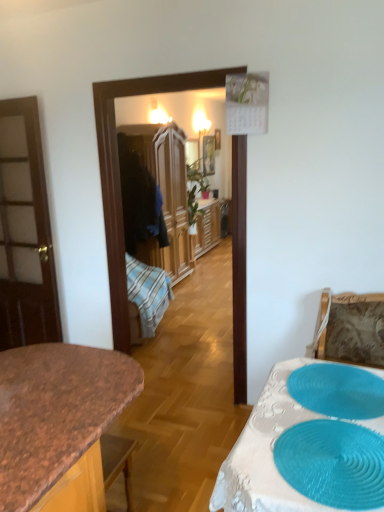
This screenshot has height=512, width=384. Describe the element at coordinates (265, 453) in the screenshot. I see `white lace tablecloth at lower right` at that location.

This screenshot has height=512, width=384. What are the coordinates of `blue textured placemat at lower right, which ranks as the first oval in back-to-front order` in the screenshot? It's located at [x=338, y=391].

Identify the location of granite countertop at center. (59, 423).

What do you see at coordinates (333, 463) in the screenshot?
I see `teal rubber placemat at lower right, arranged as the 2th oval when viewed from the back` at bounding box center [333, 463].

What is the approximate height of teal rubber placemat at lower right, which appears as the 1th oval when viewed from the front?

teal rubber placemat at lower right, which appears as the 1th oval when viewed from the front, is 2.34 centimeters in height.

What do you see at coordinates (208, 155) in the screenshot? This screenshot has height=512, width=384. I see `wooden picture frame at center` at bounding box center [208, 155].

In order to click on white lace tablecloth at lower right in this screenshot , I will do `click(265, 453)`.

Where is `table in front of the teal rubber placemat at lower right, which appears as the 1th oval when viewed from the front`? table in front of the teal rubber placemat at lower right, which appears as the 1th oval when viewed from the front is located at coordinates (265, 453).

Is white lace tablecloth at lower right completely or partially inside teal rubber placemat at lower right, arranged as the 2th oval when viewed from the back?

Definitely not — white lace tablecloth at lower right is not inside teal rubber placemat at lower right, arranged as the 2th oval when viewed from the back.

Does teal rubber placemat at lower right, which appears as the 1th oval when viewed from the front, come in front of white lace tablecloth at lower right?

No, it is behind white lace tablecloth at lower right.

Consider the image. In terms of height, does teal rubber placemat at lower right, which appears as the 1th oval when viewed from the front, look taller or shorter compared to white lace tablecloth at lower right?

teal rubber placemat at lower right, which appears as the 1th oval when viewed from the front, is shorter than white lace tablecloth at lower right.

I want to click on countertop below the wooden wardrobe at center (from a real-world perspective), so click(x=59, y=423).

Is wooden wardrobe at center oriented towards granite countertop at center?

No, wooden wardrobe at center is not facing towards granite countertop at center.

Measure the distance between wooden wardrobe at center and granite countertop at center.

wooden wardrobe at center and granite countertop at center are 3.25 meters apart from each other.

Considering the relative positions of wooden wardrobe at center and granite countertop at center in the image provided, is wooden wardrobe at center behind granite countertop at center?

Yes, it is behind granite countertop at center.

From a real-world perspective, which oval is the 2nd one above the granite countertop at center? Please provide its 2D coordinates.

[(338, 391)]

Is blue textured placemat at lower right, marked as the 2th oval in a front-to-back arrangement, next to granite countertop at center?

No, blue textured placemat at lower right, marked as the 2th oval in a front-to-back arrangement, is not making contact with granite countertop at center.

Which object is positioned more to the left, blue textured placemat at lower right, marked as the 2th oval in a front-to-back arrangement, or granite countertop at center?

Positioned to the left is granite countertop at center.

Is blue textured placemat at lower right, which ranks as the first oval in back-to-front order, surrounding granite countertop at center?

No.

Considering the points (204, 155) and (338, 482), which point is in front, point (204, 155) or point (338, 482)?

The point (338, 482) is closer to the camera.

From the image's perspective, is wooden picture frame at center on teal rubber placemat at lower right, arranged as the 2th oval when viewed from the back?

Correct, wooden picture frame at center appears higher than teal rubber placemat at lower right, arranged as the 2th oval when viewed from the back, in the image.

Looking at the image, does wooden picture frame at center seem bigger or smaller compared to teal rubber placemat at lower right, which appears as the 1th oval when viewed from the front?

Considering their sizes, wooden picture frame at center takes up more space than teal rubber placemat at lower right, which appears as the 1th oval when viewed from the front.

Considering the positions of point (271, 505) and point (109, 410), is point (271, 505) closer or farther from the camera than point (109, 410)?

Point (271, 505) is closer to the camera than point (109, 410).

How many degrees apart are the facing directions of white lace tablecloth at lower right and granite countertop at center?

There is a 91.3-degree angle between the facing directions of white lace tablecloth at lower right and granite countertop at center.

How far apart are white lace tablecloth at lower right and granite countertop at center?

white lace tablecloth at lower right is 21.99 inches away from granite countertop at center.

From the image's perspective, which one is positioned lower, white lace tablecloth at lower right or granite countertop at center?

granite countertop at center.

Is point (60, 381) behind point (377, 416)?

Yes, it is behind point (377, 416).

Is granite countertop at center further to the viewer compared to blue textured placemat at lower right, marked as the 2th oval in a front-to-back arrangement?

No, it is in front of blue textured placemat at lower right, marked as the 2th oval in a front-to-back arrangement.

Which is correct: blue textured placemat at lower right, which ranks as the first oval in back-to-front order, is inside wooden wardrobe at center, or outside of it?

blue textured placemat at lower right, which ranks as the first oval in back-to-front order, is spatially situated outside wooden wardrobe at center.

Is blue textured placemat at lower right, which ranks as the first oval in back-to-front order, oriented away from wooden wardrobe at center?

blue textured placemat at lower right, which ranks as the first oval in back-to-front order, is not turned away from wooden wardrobe at center.

I want to click on table located underneath the teal rubber placemat at lower right, arranged as the 2th oval when viewed from the back (from a real-world perspective), so click(x=265, y=453).

Locate an element on the screen. cabinetry located behind the granite countertop at center is located at coordinates pyautogui.click(x=165, y=194).

Which object lies further to the anchor point teal rubber placemat at lower right, which appears as the 1th oval when viewed from the front, wooden picture frame at center or white lace tablecloth at lower right?

wooden picture frame at center is further to teal rubber placemat at lower right, which appears as the 1th oval when viewed from the front.

In the scene shown: Considering their positions, is teal rubber placemat at lower right, arranged as the 2th oval when viewed from the back, positioned closer to granite countertop at center than wooden wardrobe at center?

teal rubber placemat at lower right, arranged as the 2th oval when viewed from the back.

Based on their spatial positions, is blue textured placemat at lower right, which ranks as the first oval in back-to-front order, or white lace tablecloth at lower right closer to teal rubber placemat at lower right, which appears as the 1th oval when viewed from the front?

white lace tablecloth at lower right is closer to teal rubber placemat at lower right, which appears as the 1th oval when viewed from the front.

From the picture: Estimate the real-world distances between objects in this image. Which object is closer to wooden wardrobe at center, wooden picture frame at center or blue textured placemat at lower right, which ranks as the first oval in back-to-front order?

wooden picture frame at center is closer to wooden wardrobe at center.

Consider the image. Which object lies further to the anchor point granite countertop at center, teal rubber placemat at lower right, arranged as the 2th oval when viewed from the back, or wooden picture frame at center?

wooden picture frame at center is further to granite countertop at center.

Based on their spatial positions, is white lace tablecloth at lower right or blue textured placemat at lower right, marked as the 2th oval in a front-to-back arrangement, closer to wooden picture frame at center?

blue textured placemat at lower right, marked as the 2th oval in a front-to-back arrangement, lies closer to wooden picture frame at center than the other object.

Considering their positions, is teal rubber placemat at lower right, arranged as the 2th oval when viewed from the back, positioned further to white lace tablecloth at lower right than granite countertop at center?

granite countertop at center lies further to white lace tablecloth at lower right than the other object.

From the image, which object appears to be nearer to wooden wardrobe at center, granite countertop at center or wooden picture frame at center?

Based on the image, wooden picture frame at center appears to be nearer to wooden wardrobe at center.

Find the location of `countertop between white lace tablecloth at lower right and wooden picture frame at center from front to back`. countertop between white lace tablecloth at lower right and wooden picture frame at center from front to back is located at coordinates (59, 423).

The width and height of the screenshot is (384, 512). Identify the location of oval between teal rubber placemat at lower right, arranged as the 2th oval when viewed from the back, and wooden picture frame at center from front to back. (338, 391).

I want to click on cabinetry between blue textured placemat at lower right, marked as the 2th oval in a front-to-back arrangement, and wooden picture frame at center, along the z-axis, so click(165, 194).

The height and width of the screenshot is (512, 384). In order to click on oval between granite countertop at center and blue textured placemat at lower right, which ranks as the first oval in back-to-front order in this screenshot , I will do `click(333, 463)`.